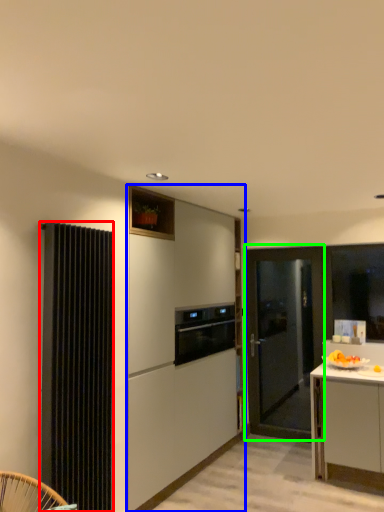
Question: Which object is positioned farthest from radiator (highlighted by a red box)? Select from cabinetry (highlighted by a blue box) and door (highlighted by a green box).

Choices:
 (A) cabinetry
 (B) door

Answer: (B)